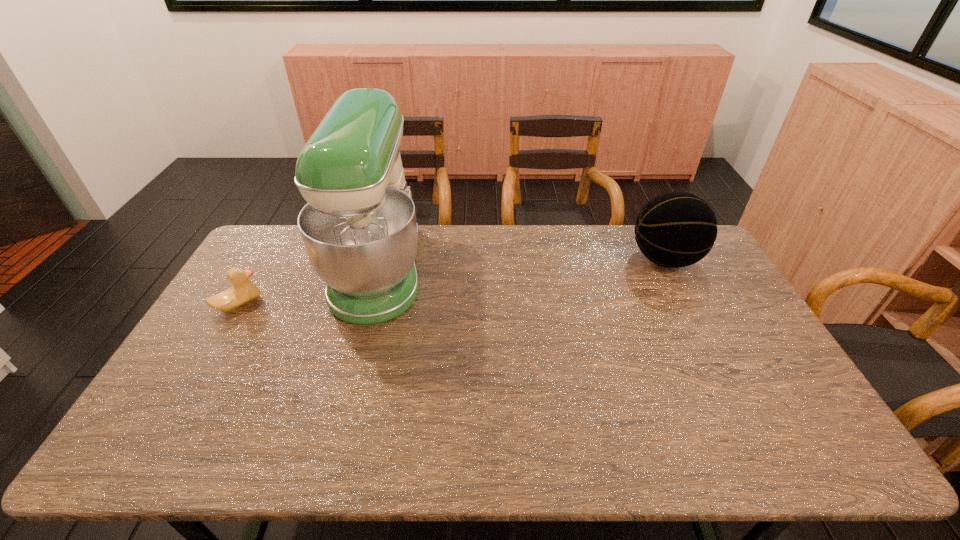
The image size is (960, 540). I want to click on free space in the image that satisfies the following two spatial constraints: 1. on the front side of the rightmost object; 2. at the beak of the leftmost object, so click(687, 304).